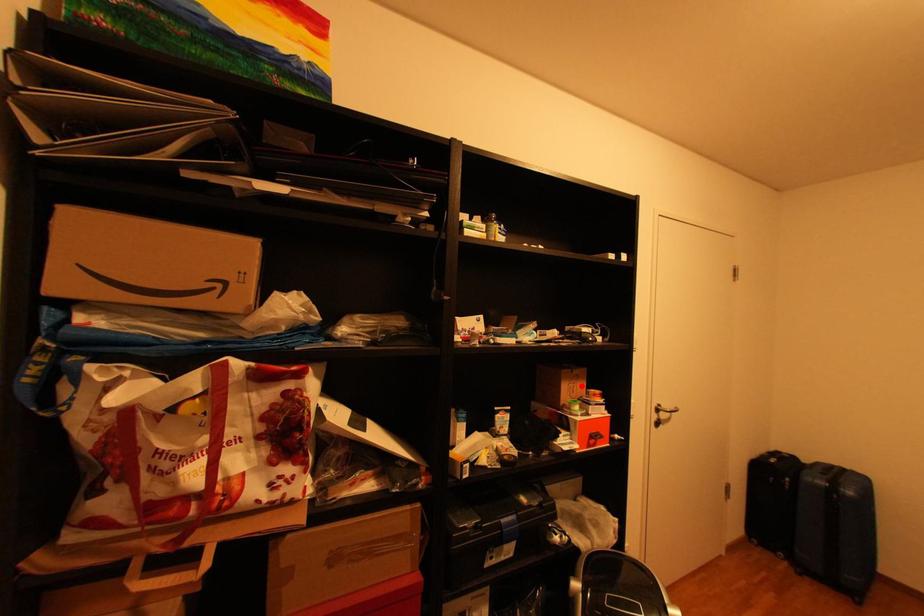
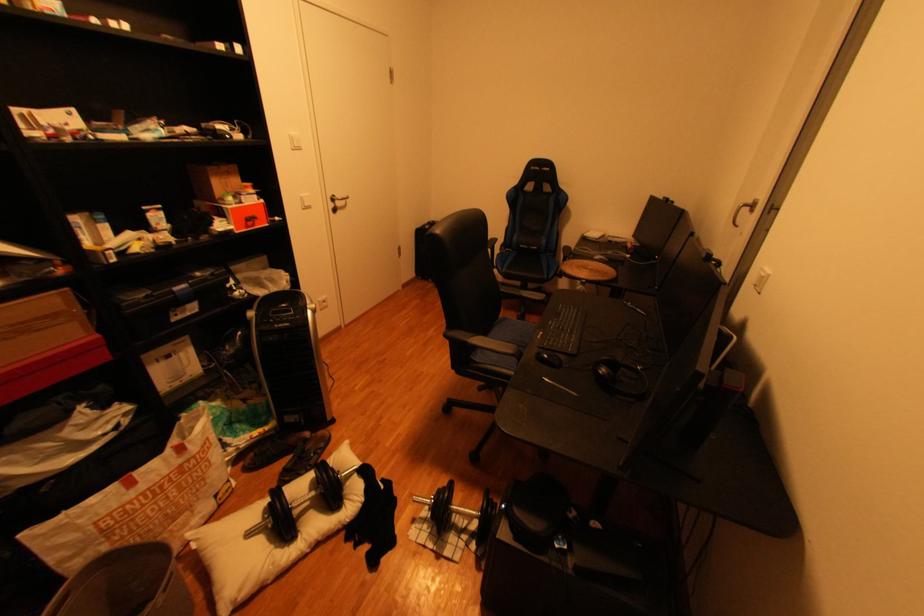
Find the pixel in the second image that matches the highlighted location in the first image.

(235, 182)